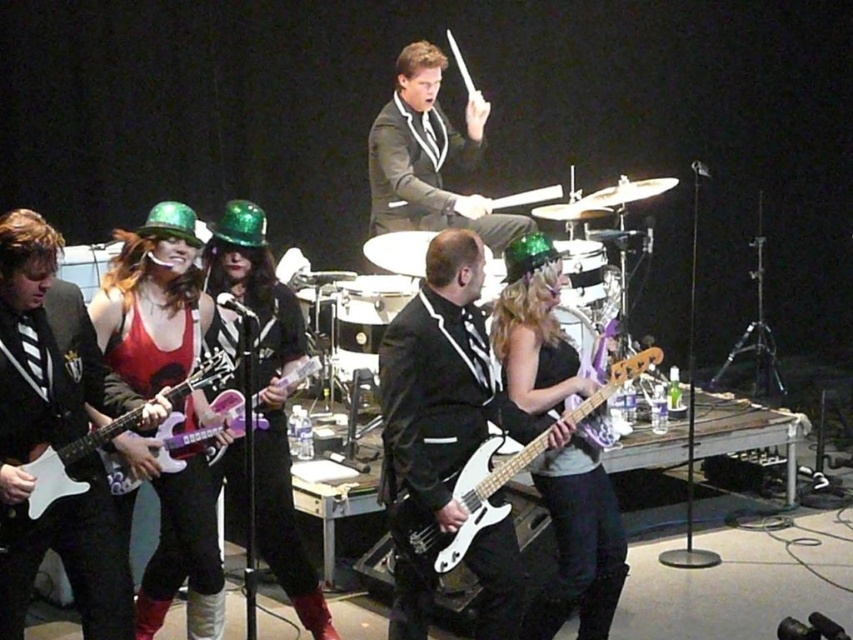
You are a stagehand who needs to place a protective cover over both the shiny black bass guitar at center and the purple glossy electric guitar at center. Based on the description, which guitar requires a larger cover?

The shiny black bass guitar at center requires a larger cover because it is larger in size than the purple glossy electric guitar at center.

You are a photographer at the concert venue. You want to capture a closeup shot of the shiny black bass guitar at center. The stage is dimly lit, but there is a spotlight at point (579, 540). Where should you aim your camera to get the best lighting?

The point (579, 540) is where the spotlight is located, and it is shining on the shiny black bass guitar at center. Aim your camera at the shiny black bass guitar at center under the spotlight at point (579, 540) for optimal lighting.

In the band performance scene, there are two drums at the center of the stage. The brushed metal drum at center and the shiny silver drum at center. Which one is positioned to the left?

The brushed metal drum at center is positioned to the left of the shiny silver drum at center.